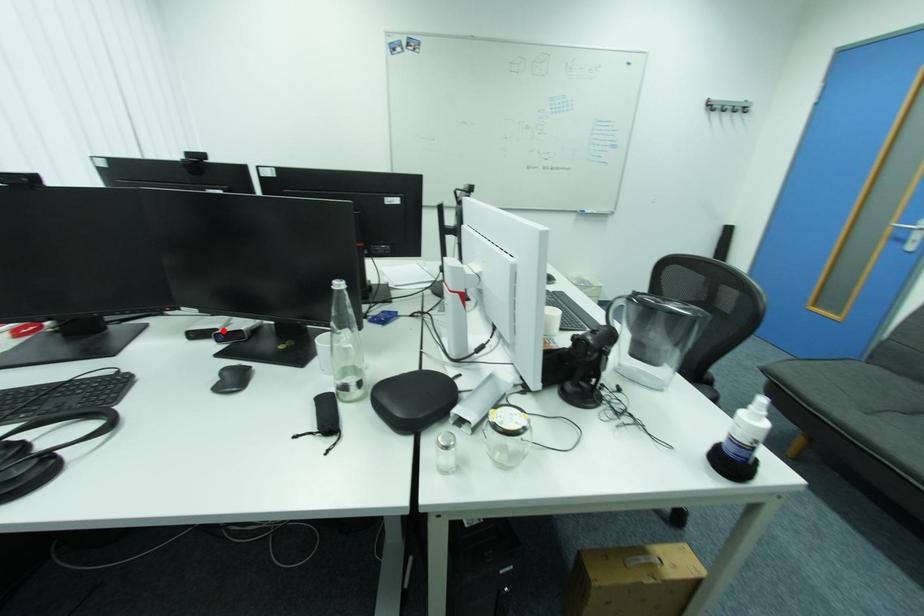
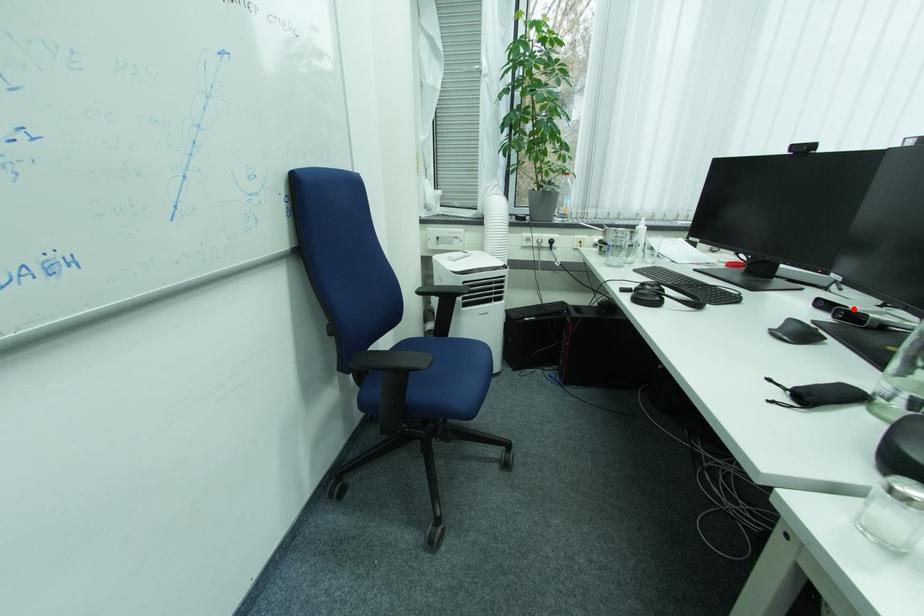
I am providing you with two images of the same scene from different viewpoints. A red point is marked on the first image and another point is marked on the second image. Is the red point in image1 aligned with the point shown in image2?

Yes